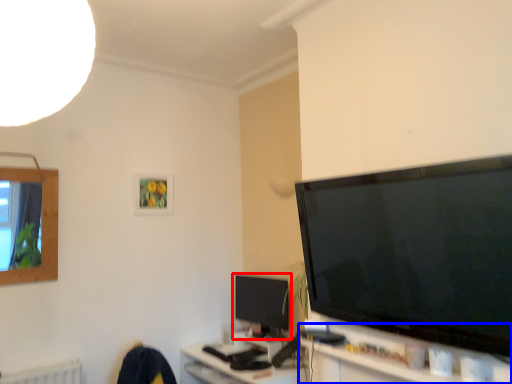
Question: Which object appears closest to the camera in this image, television (highlighted by a red box) or tv cabinet (highlighted by a blue box)?

Choices:
 (A) television
 (B) tv cabinet

Answer: (B)